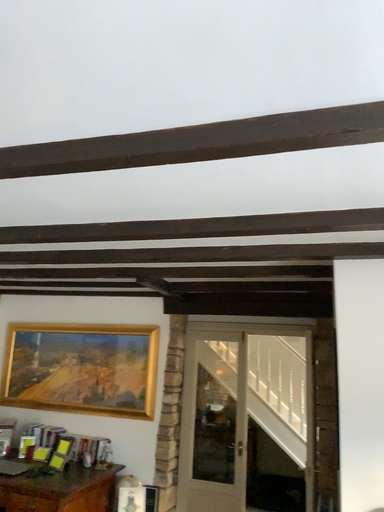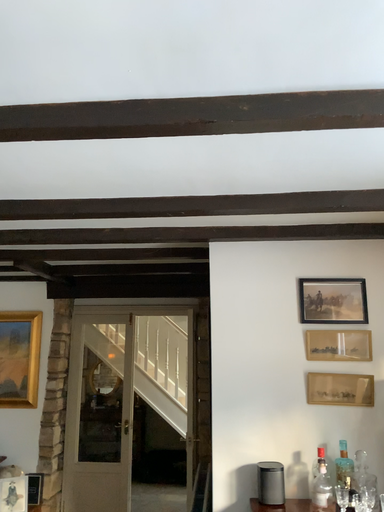
Question: Which way did the camera rotate in the video?

Choices:
 (A) rotated right
 (B) rotated left

Answer: (A)